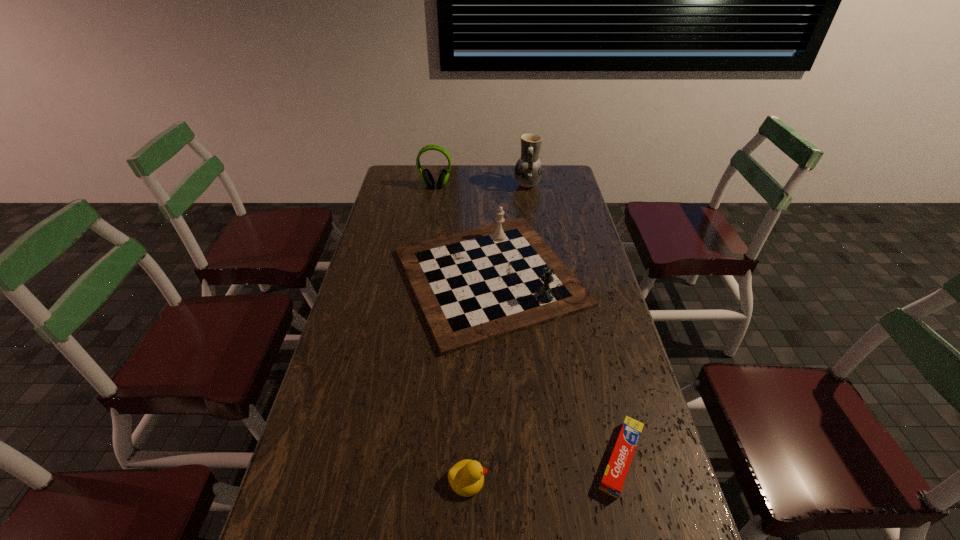
This screenshot has height=540, width=960. In order to click on free spot that satisfies the following two spatial constraints: 1. on either side of the tallest object; 2. on the back side of the shortest object in this screenshot , I will do `click(572, 458)`.